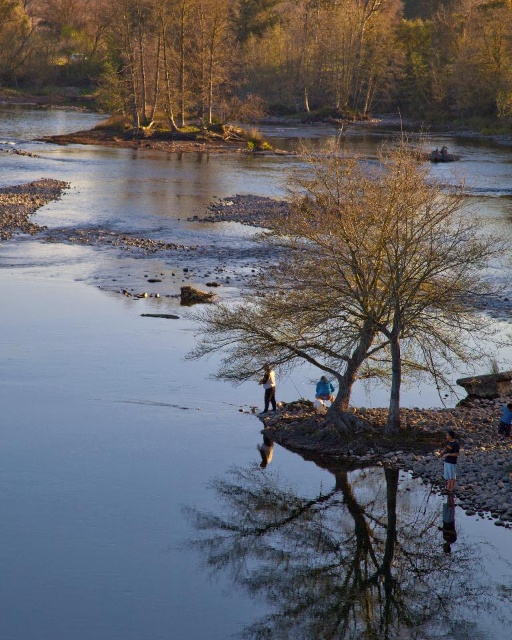
Question: Estimate the real-world distances between objects in this image. Which object is closer to the blue denim shorts at lower right?

Choices:
 (A) green leafy tree at upper center
 (B) blue denim jeans at lower center
 (C) blue cotton shirt at lower right
 (D) light brown leather jacket at center

Answer: (C)

Question: Does brown leafy tree at center appear under blue cotton shirt at lower right?

Choices:
 (A) no
 (B) yes

Answer: (A)

Question: Which point is closer to the camera?

Choices:
 (A) (165, 61)
 (B) (502, 406)
 (C) (318, 387)

Answer: (C)

Question: Among these objects, which one is nearest to the camera?

Choices:
 (A) green leafy tree at upper center
 (B) blue denim shorts at lower right

Answer: (B)

Question: Does light brown leather jacket at center appear over blue denim jeans at lower center?

Choices:
 (A) no
 (B) yes

Answer: (B)

Question: Is blue denim jeans at lower center above blue cotton shirt at lower right?

Choices:
 (A) yes
 (B) no

Answer: (A)